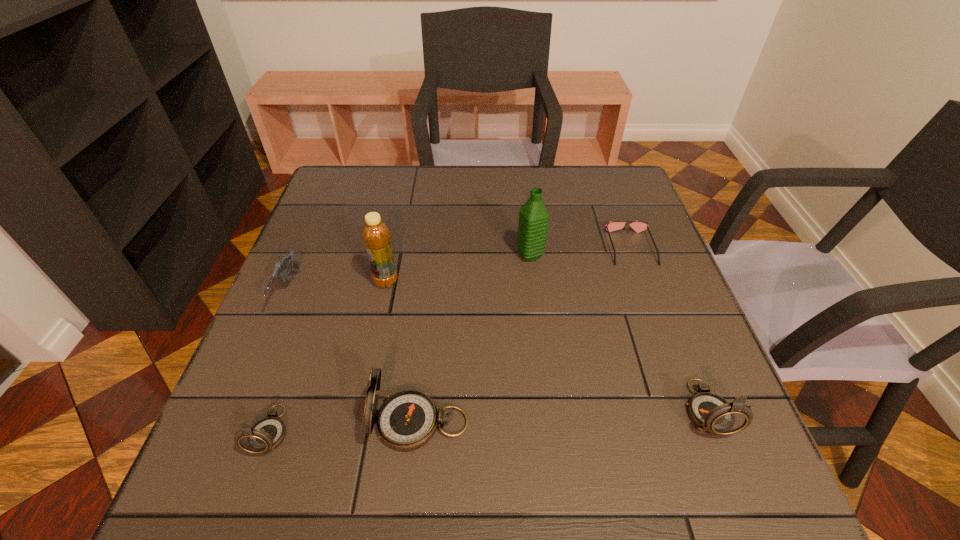
In order to click on sunglasses that is positioned at the right edge in this screenshot , I will do `click(638, 226)`.

Image resolution: width=960 pixels, height=540 pixels. Find the location of `object present at the near left corner`. object present at the near left corner is located at coordinates (265, 435).

You are a GUI agent. You are given a task and a screenshot of the screen. Output one action in this format:
    pyautogui.click(x=<x>, y=<y>)
    Task: Click on the object located in the near right corner section of the desktop
    The width and height of the screenshot is (960, 540).
    Given the screenshot: What is the action you would take?
    tap(711, 413)

Locate an element on the screen. The image size is (960, 540). vacant space at the far edge of the desktop is located at coordinates (398, 211).

The image size is (960, 540). What are the coordinates of `free space at the near edge of the desktop` in the screenshot? It's located at (324, 417).

You are a GUI agent. You are given a task and a screenshot of the screen. Output one action in this format:
    pyautogui.click(x=<x>, y=<y>)
    Task: Click on the free space at the left edge of the desktop
    
    Given the screenshot: What is the action you would take?
    [x=346, y=247]

Identify the location of vacant space at the right edge. (635, 234).

Where is `vacant area at the far left corner`? This screenshot has width=960, height=540. vacant area at the far left corner is located at coordinates (329, 206).

Where is `vacant space at the near left corner of the desktop`? Image resolution: width=960 pixels, height=540 pixels. vacant space at the near left corner of the desktop is located at coordinates (274, 398).

The height and width of the screenshot is (540, 960). I want to click on vacant space at the far right corner of the desktop, so click(626, 204).